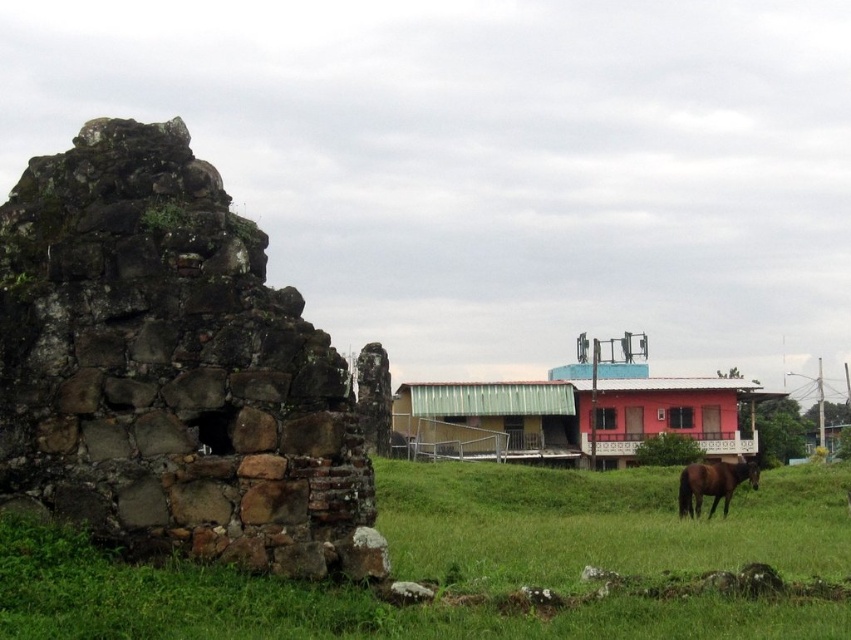
Is brown stone ruins at left bigger than green grassy at lower left?

No, brown stone ruins at left is not bigger than green grassy at lower left.

Does point (107, 300) come closer to viewer compared to point (30, 524)?

No, (107, 300) is behind (30, 524).

You are a GUI agent. You are given a task and a screenshot of the screen. Output one action in this format:
    pyautogui.click(x=<x>, y=<y>)
    Task: Click on the brown stone ruins at left
    This screenshot has height=640, width=851.
    Given the screenshot: What is the action you would take?
    pyautogui.click(x=170, y=368)

Is point (398, 532) in front of point (414, 428)?

Yes.

Where is `green grassy at lower left`? green grassy at lower left is located at coordinates (600, 524).

This screenshot has height=640, width=851. What do you see at coordinates (600, 524) in the screenshot?
I see `green grassy at lower left` at bounding box center [600, 524].

Identify the location of green grassy at lower left. (600, 524).

Who is positioned more to the right, green corrugated metal hut at center or brown glossy horse at lower right?

brown glossy horse at lower right

Which of these two, green corrugated metal hut at center or brown glossy horse at lower right, stands shorter?

brown glossy horse at lower right

Image resolution: width=851 pixels, height=640 pixels. Find the location of `green corrugated metal hut at center`. green corrugated metal hut at center is located at coordinates (488, 420).

What are the coordinates of `green corrugated metal hut at center` in the screenshot? It's located at (488, 420).